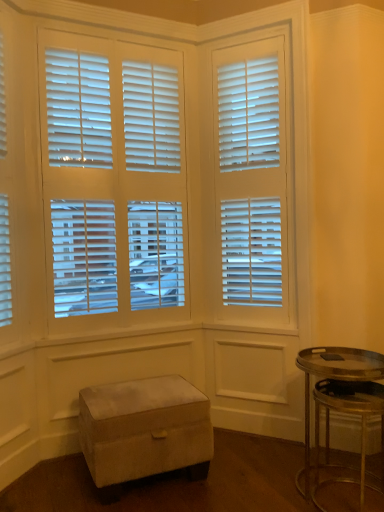
Question: Should I look upward or downward to see metallic gold table at lower right?

Choices:
 (A) down
 (B) up

Answer: (A)

Question: Can you confirm if metallic gold table at lower right is positioned to the right of suede ottoman at lower left?

Choices:
 (A) yes
 (B) no

Answer: (A)

Question: Does metallic gold table at lower right have a greater height compared to suede ottoman at lower left?

Choices:
 (A) yes
 (B) no

Answer: (A)

Question: Does metallic gold table at lower right have a lesser width compared to suede ottoman at lower left?

Choices:
 (A) yes
 (B) no

Answer: (A)

Question: Is metallic gold table at lower right smaller than suede ottoman at lower left?

Choices:
 (A) no
 (B) yes

Answer: (B)

Question: From the image's perspective, is metallic gold table at lower right above suede ottoman at lower left?

Choices:
 (A) no
 (B) yes

Answer: (B)

Question: Is metallic gold table at lower right in contact with suede ottoman at lower left?

Choices:
 (A) no
 (B) yes

Answer: (A)

Question: Is suede ottoman at lower left oriented towards metallic gold table at lower right?

Choices:
 (A) yes
 (B) no

Answer: (B)

Question: Is suede ottoman at lower left looking in the opposite direction of metallic gold table at lower right?

Choices:
 (A) yes
 (B) no

Answer: (B)

Question: Is suede ottoman at lower left far away from metallic gold table at lower right?

Choices:
 (A) no
 (B) yes

Answer: (A)

Question: Is suede ottoman at lower left at the right side of metallic gold table at lower right?

Choices:
 (A) no
 (B) yes

Answer: (A)

Question: Can you confirm if suede ottoman at lower left is smaller than metallic gold table at lower right?

Choices:
 (A) no
 (B) yes

Answer: (A)

Question: From a real-world perspective, is suede ottoman at lower left beneath metallic gold table at lower right?

Choices:
 (A) yes
 (B) no

Answer: (A)

Question: Considering the relative positions of metallic gold table at lower right and suede ottoman at lower left in the image provided, is metallic gold table at lower right to the left or to the right of suede ottoman at lower left?

Choices:
 (A) right
 (B) left

Answer: (A)